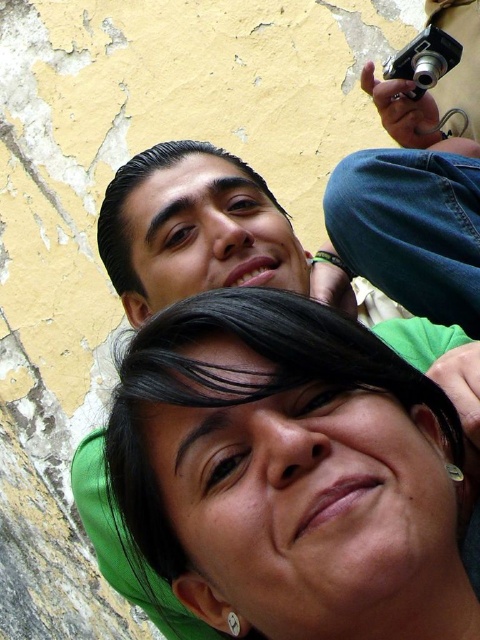
You are a photographer analyzing the composition of this image. The green matte hair at center is located at a specific coordinate. If you want to ensure the subject is centered in the frame, should you move the camera to the left or right?

The green matte hair at center is already at the center of the frame since its coordinates are at point (235, 410), which is close to the center point of the image. Therefore, no adjustment is needed.

You are standing in front of the two people in the image. The point labeled as point (235,410) is part of which object?

The point (235,410) represents the green matte hair at center.

You are a photographer trying to adjust the lighting for a photo shoot. You notice the green matte hair at center and the black plastic camera at upper right in the frame. Which object is closer to the camera lens?

The green matte hair at center is shorter than the black plastic camera at upper right, so it is closer to the camera lens because shorter objects are typically nearer in such compositions.